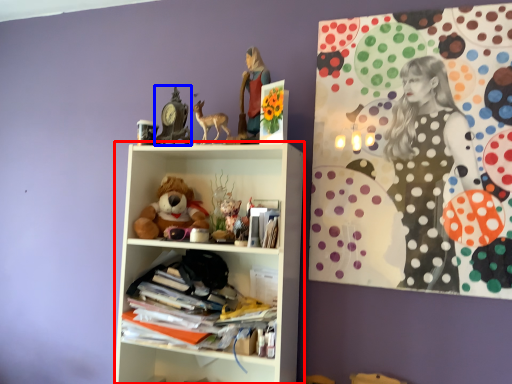
Question: Which of the following is the closest to the observer, shelf (highlighted by a red box) or art (highlighted by a blue box)?

Choices:
 (A) shelf
 (B) art

Answer: (A)